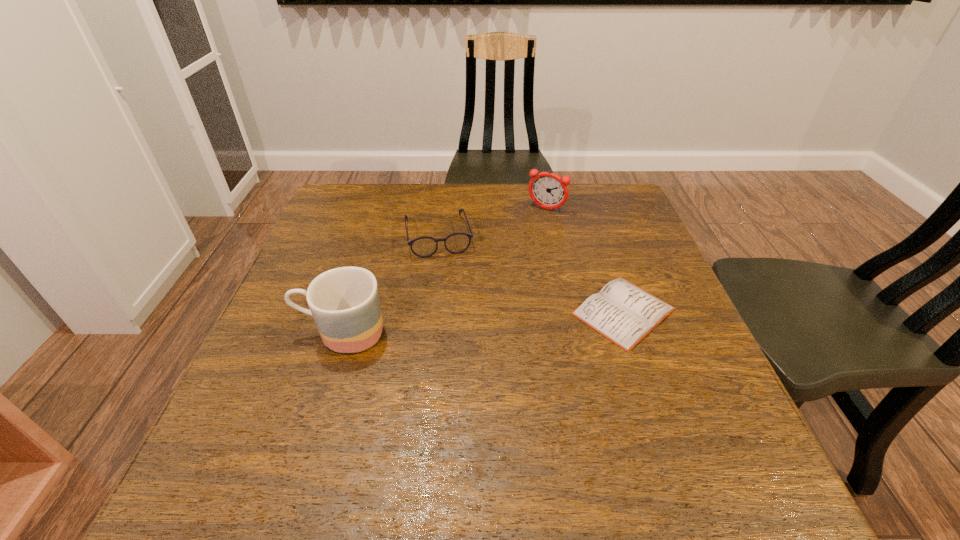
The width and height of the screenshot is (960, 540). Find the location of `mug`. mug is located at coordinates (344, 302).

You are a GUI agent. You are given a task and a screenshot of the screen. Output one action in this format:
    pyautogui.click(x=<x>, y=<y>)
    Task: Click on the shortest object
    This screenshot has height=540, width=960.
    Given the screenshot: What is the action you would take?
    pyautogui.click(x=622, y=312)

Find the location of a particular element. This screenshot has height=540, width=960. alarm clock is located at coordinates (548, 190).

Locate an element on the screen. spectacles is located at coordinates (456, 243).

Identify the location of free space located 0.060m on the side with the handle of the mug. Image resolution: width=960 pixels, height=540 pixels. (269, 332).

Locate an element on the screen. This screenshot has height=540, width=960. blank area located 0.060m on the side with the handle of the mug is located at coordinates tap(269, 332).

The image size is (960, 540). I want to click on vacant space located on the left of the diary, so click(547, 312).

In order to click on vacant space situated on the front-facing side of the alarm clock in this screenshot , I will do `click(496, 281)`.

The image size is (960, 540). In order to click on free location located 0.120m on the front-facing side of the alarm clock in this screenshot , I will do `click(525, 238)`.

You are a GUI agent. You are given a task and a screenshot of the screen. Output one action in this format:
    pyautogui.click(x=<x>, y=<y>)
    Task: Click on the vacant space positioned on the front-facing side of the alarm clock
    The image size is (960, 540).
    Given the screenshot: What is the action you would take?
    pyautogui.click(x=526, y=235)